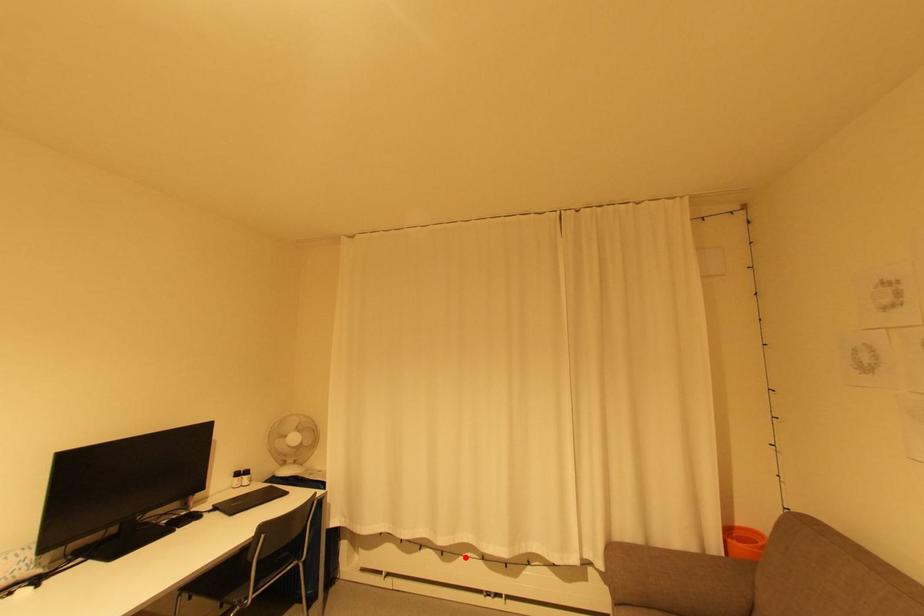
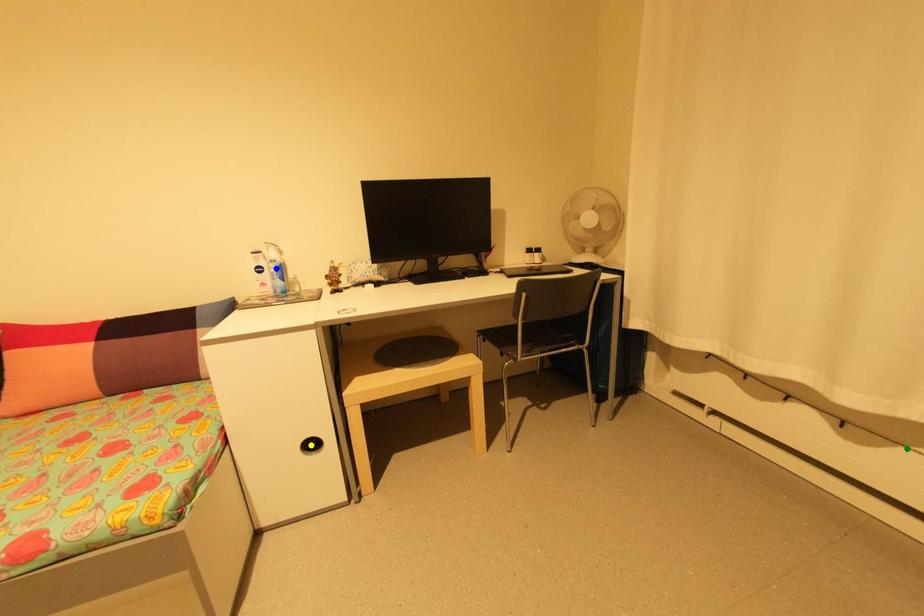
Question: I am providing you with two images of the same scene from different viewpoints. A red point is marked on the first image. You are given multiple points on the second image. Which point in image 2 represents the same 3d spot as the red point in image 1?

Choices:
 (A) blue point
 (B) green point
 (C) yellow point

Answer: (B)